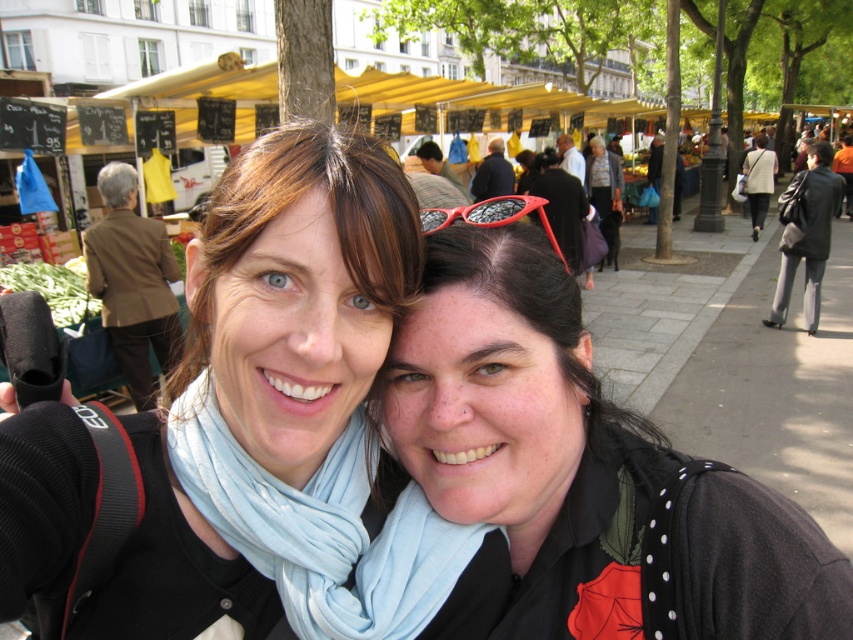
Question: Estimate the real-world distances between objects in this image. Which object is farther from the blue scarf at center?

Choices:
 (A) light blue fabric scarf at center
 (B) brown leather jacket at left

Answer: (B)

Question: Considering the real-world distances, which object is farthest from the blue scarf at center?

Choices:
 (A) matte black shirt at center
 (B) brown leather jacket at left

Answer: (B)

Question: Does blue scarf at center lie in front of matte black shirt at center?

Choices:
 (A) yes
 (B) no

Answer: (A)

Question: Among these objects, which one is farthest from the camera?

Choices:
 (A) blue scarf at center
 (B) brown leather jacket at left
 (C) matte black shirt at center
 (D) light blue fabric scarf at center

Answer: (B)

Question: Can you confirm if matte black shirt at center is positioned below light blue fabric scarf at center?

Choices:
 (A) yes
 (B) no

Answer: (B)

Question: Is matte black shirt at center bigger than light blue fabric scarf at center?

Choices:
 (A) no
 (B) yes

Answer: (B)